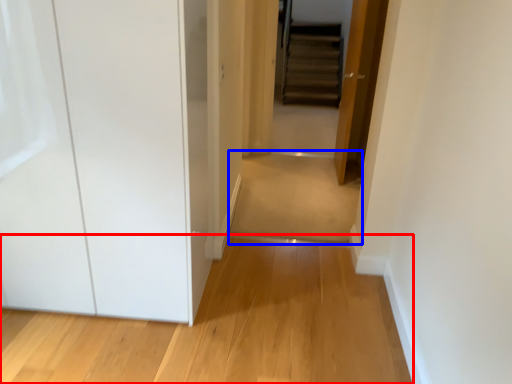
Question: Among these objects, which one is nearest to the camera, path (highlighted by a red box) or path (highlighted by a blue box)?

Choices:
 (A) path
 (B) path

Answer: (A)